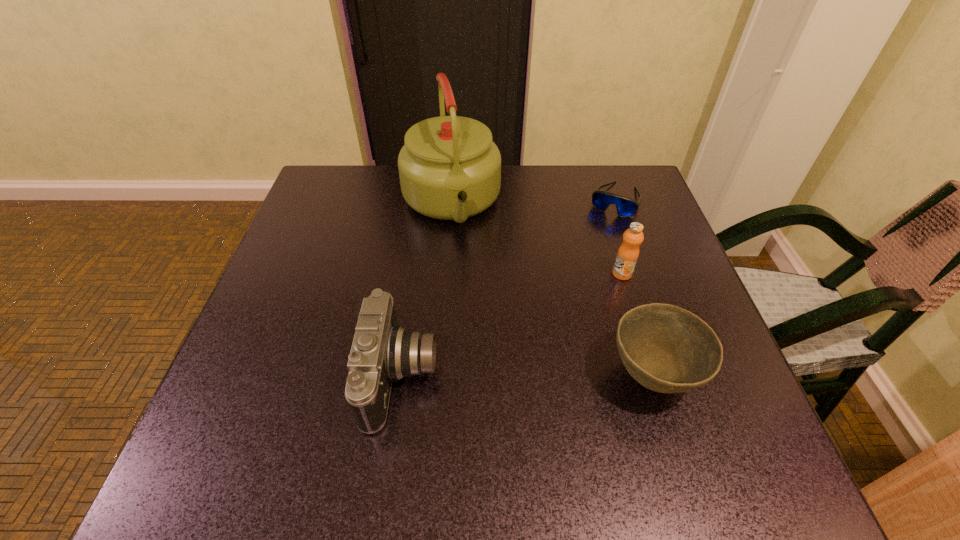
Locate an element on the screen. The width and height of the screenshot is (960, 540). free space at the far right corner is located at coordinates (614, 172).

Where is `vacant space that's between the kettle and the shortest object`? The height and width of the screenshot is (540, 960). vacant space that's between the kettle and the shortest object is located at coordinates (533, 202).

Find the location of `vacant area that lies between the kettle and the camera`. vacant area that lies between the kettle and the camera is located at coordinates (426, 290).

Identify the location of vacant point located between the sunglasses and the camera. The width and height of the screenshot is (960, 540). (508, 288).

In order to click on free space between the orange juice and the camera in this screenshot , I will do click(512, 325).

Locate an element on the screen. This screenshot has width=960, height=540. free space that is in between the camera and the orange juice is located at coordinates (512, 325).

Find the location of a particular element. The width and height of the screenshot is (960, 540). unoccupied area between the sunglasses and the tallest object is located at coordinates (533, 202).

This screenshot has height=540, width=960. In order to click on unoccupied area between the bowl and the tallest object in this screenshot , I will do `click(551, 289)`.

At what (x,y) coordinates should I click in order to perform the action: click on vacant area between the third nearest object and the kettle. Please return your answer as a coordinate pair (x, y). Looking at the image, I should click on (537, 239).

Where is `blank region between the kettle and the second shortest object`? This screenshot has height=540, width=960. blank region between the kettle and the second shortest object is located at coordinates (551, 289).